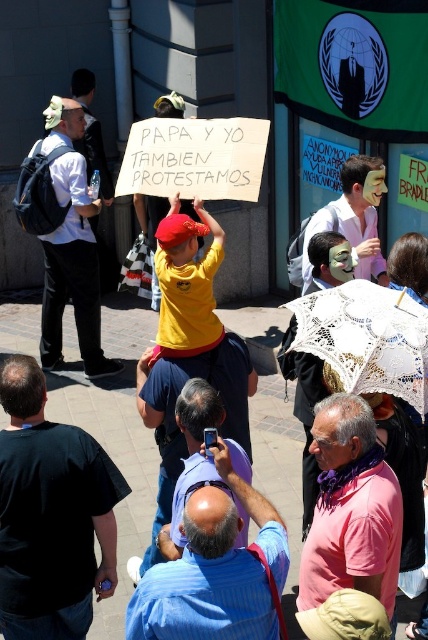
Is pink matte shirt at center taller than lace fabric umbrella at center?

Yes, pink matte shirt at center is taller than lace fabric umbrella at center.

I want to click on pink matte shirt at center, so click(350, 508).

Who is more distant from viewer, (380, 486) or (321, 333)?

Positioned behind is point (321, 333).

Image resolution: width=428 pixels, height=640 pixels. In order to click on pink matte shirt at center in this screenshot , I will do `click(350, 508)`.

In the scene shown: Is blue striped shirt at center above white matte mask at center?

No.

Is blue striped shirt at center behind white matte mask at center?

No, blue striped shirt at center is closer to the viewer.

Which is behind, point (187, 516) or point (353, 193)?

Positioned behind is point (353, 193).

I want to click on blue striped shirt at center, so click(205, 582).

Which is in front, point (45, 500) or point (377, 243)?

Point (45, 500) is more forward.

This screenshot has height=640, width=428. Describe the element at coordinates (50, 515) in the screenshot. I see `black shirt at lower left` at that location.

Between point (45, 445) and point (362, 262), which one is positioned in front?

Point (45, 445)

Find the location of a particular element. black shirt at lower left is located at coordinates (50, 515).